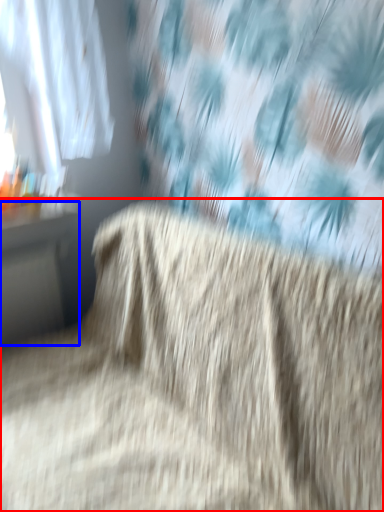
Question: Which object appears closest to the camera in this image, furniture (highlighted by a red box) or table (highlighted by a blue box)?

Choices:
 (A) furniture
 (B) table

Answer: (A)